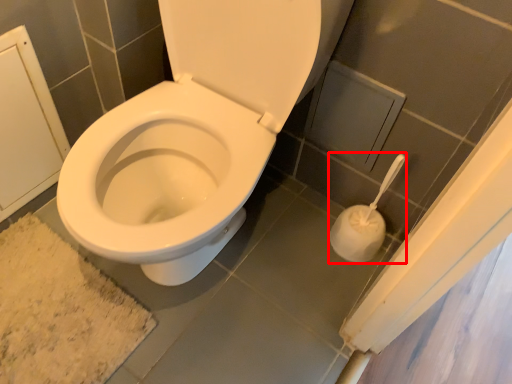
Question: From the image's perspective, what is the correct spatial relationship of toilet paper (annotated by the red box) in relation to bath mat?

Choices:
 (A) above
 (B) below

Answer: (A)